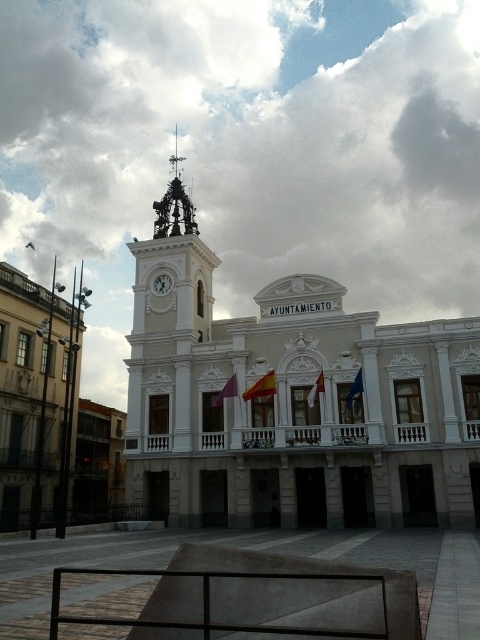
Is white stone building at center wider than red fabric flag at center?

Correct, the width of white stone building at center exceeds that of red fabric flag at center.

In the scene shown: Who is shorter, white stone building at center or red fabric flag at center?

With less height is red fabric flag at center.

Based on the photo, who is more forward, (472,493) or (266,374)?

Point (472,493) is more forward.

Where is `white stone building at center`? white stone building at center is located at coordinates (291, 401).

Looking at this image, can you confirm if red fabric flag at center is wider than white glossy clock at upper left?

Correct, the width of red fabric flag at center exceeds that of white glossy clock at upper left.

Between red fabric flag at center and white glossy clock at upper left, which one is positioned lower?

red fabric flag at center is lower down.

Find the location of a particular element. red fabric flag at center is located at coordinates (261, 387).

Is dark gray metal rail at lower center wider than red fabric flag at center?

Yes.

Is dark gray metal rail at lower center below red fabric flag at center?

Indeed, dark gray metal rail at lower center is positioned under red fabric flag at center.

Who is more distant from viewer, (233, 572) or (251, 394)?

The point (251, 394) is more distant.

Find the location of a particular element. The height and width of the screenshot is (640, 480). dark gray metal rail at lower center is located at coordinates (207, 602).